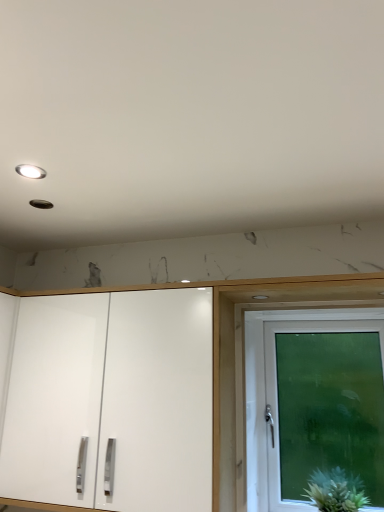
Question: Is white glossy cabinet doors at center further to camera compared to green fuzzy plant at lower right?

Choices:
 (A) no
 (B) yes

Answer: (A)

Question: Considering the relative sizes of white glossy cabinet doors at center and green fuzzy plant at lower right in the image provided, is white glossy cabinet doors at center thinner than green fuzzy plant at lower right?

Choices:
 (A) no
 (B) yes

Answer: (A)

Question: Is white glossy cabinet doors at center oriented away from green fuzzy plant at lower right?

Choices:
 (A) yes
 (B) no

Answer: (B)

Question: From the image's perspective, is white glossy cabinet doors at center located beneath green fuzzy plant at lower right?

Choices:
 (A) yes
 (B) no

Answer: (B)

Question: From the image's perspective, would you say white glossy cabinet doors at center is positioned over green fuzzy plant at lower right?

Choices:
 (A) no
 (B) yes

Answer: (B)

Question: From a real-world perspective, relative to white glass door at right, is matte white light fixture at upper left vertically above or below?

Choices:
 (A) above
 (B) below

Answer: (A)

Question: Relative to white glass door at right, is matte white light fixture at upper left in front or behind?

Choices:
 (A) front
 (B) behind

Answer: (A)

Question: In terms of height, does matte white light fixture at upper left look taller or shorter compared to white glass door at right?

Choices:
 (A) tall
 (B) short

Answer: (B)

Question: From the image's perspective, is matte white light fixture at upper left above or below white glass door at right?

Choices:
 (A) below
 (B) above

Answer: (B)

Question: Based on their sizes in the image, would you say matte white light fixture at upper left is bigger or smaller than green fuzzy plant at lower right?

Choices:
 (A) big
 (B) small

Answer: (B)

Question: Is matte white light fixture at upper left spatially inside green fuzzy plant at lower right, or outside of it?

Choices:
 (A) outside
 (B) inside

Answer: (A)

Question: Is matte white light fixture at upper left taller or shorter than green fuzzy plant at lower right?

Choices:
 (A) short
 (B) tall

Answer: (A)

Question: Would you say matte white light fixture at upper left is to the left or to the right of green fuzzy plant at lower right in the picture?

Choices:
 (A) right
 (B) left

Answer: (B)

Question: In terms of height, does white glass door at right look taller or shorter compared to green fuzzy plant at lower right?

Choices:
 (A) tall
 (B) short

Answer: (A)

Question: Do you think white glass door at right is within green fuzzy plant at lower right, or outside of it?

Choices:
 (A) inside
 (B) outside

Answer: (B)